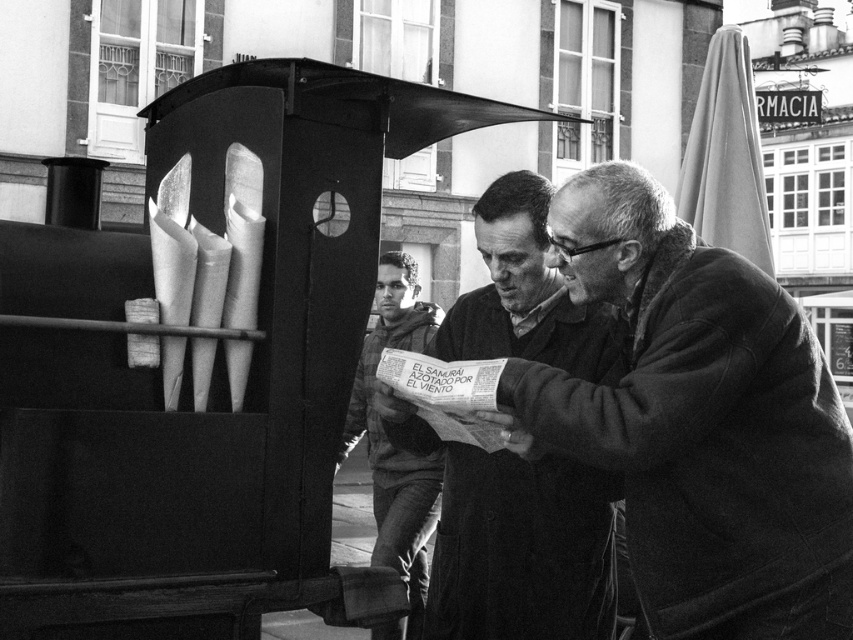
Is dark woolen sweater at center thinner than dark gray hoodie at center?

In fact, dark woolen sweater at center might be wider than dark gray hoodie at center.

Between dark woolen sweater at center and dark gray hoodie at center, which one is positioned higher?

dark woolen sweater at center is higher up.

You are a GUI agent. You are given a task and a screenshot of the screen. Output one action in this format:
    pyautogui.click(x=<x>, y=<y>)
    Task: Click on the dark woolen sweater at center
    
    Given the screenshot: What is the action you would take?
    pyautogui.click(x=700, y=420)

Does metallic bus stop at center appear on the right side of smooth leather jacket at center?

Incorrect, metallic bus stop at center is not on the right side of smooth leather jacket at center.

Does point (315, 588) come closer to viewer compared to point (474, 301)?

Yes, point (315, 588) is in front of point (474, 301).

The width and height of the screenshot is (853, 640). Identify the location of metallic bus stop at center. (196, 371).

Can you confirm if metallic bus stop at center is shorter than dark gray hoodie at center?

Correct, metallic bus stop at center is not as tall as dark gray hoodie at center.

Looking at this image, can you confirm if metallic bus stop at center is wider than dark gray hoodie at center?

Indeed, metallic bus stop at center has a greater width compared to dark gray hoodie at center.

Is point (491, 118) behind point (432, 483)?

No, (491, 118) is closer to viewer.

At what (x,y) coordinates should I click in order to perform the action: click on metallic bus stop at center. Please return your answer as a coordinate pair (x, y). This screenshot has height=640, width=853. Looking at the image, I should click on (196, 371).